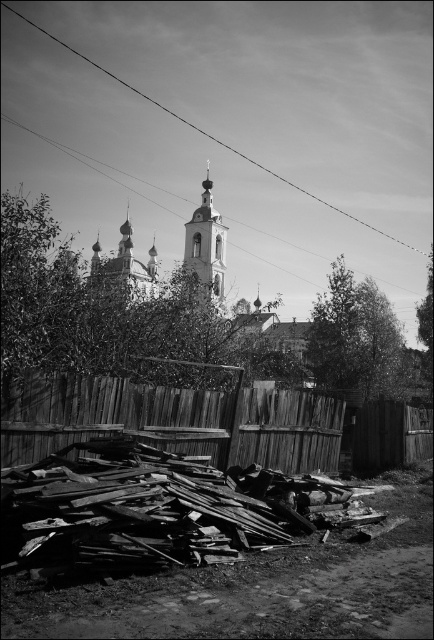
You are standing in front of the scene and want to touch both the wooden fence at lower center and the metallic wire at upper center. Which object will require you to reach further away from your current position?

The metallic wire at upper center is further away from the viewer than the wooden fence at lower center, so you will need to reach further to touch the metallic wire at upper center.

You are an artist planning to paint the scene. You want to ensure the rusty wood debris at lower center and the wooden fence at lower center are placed correctly. Based on the scene description, which object should be drawn to the left of the other?

The rusty wood debris at lower center should be drawn to the left of the wooden fence at lower center because the description states that the rusty wood debris at lower center is positioned on the left side of wooden fence at lower center.